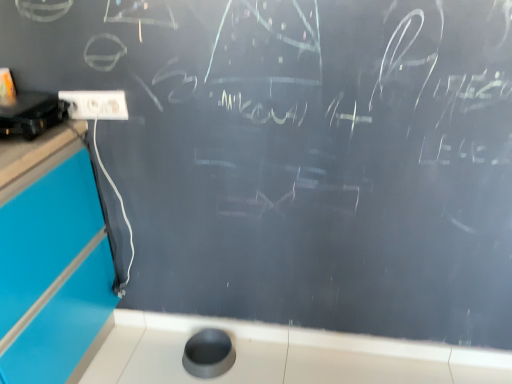
Question: Considering the positions of white plastic electric outlet at upper left and black plastic projector at upper left in the image, is white plastic electric outlet at upper left wider or thinner than black plastic projector at upper left?

Choices:
 (A) wide
 (B) thin

Answer: (B)

Question: From the image's perspective, is white plastic electric outlet at upper left located above or below black plastic projector at upper left?

Choices:
 (A) below
 (B) above

Answer: (B)

Question: Estimate the real-world distances between objects in this image. Which object is farther from the black plastic projector at upper left?

Choices:
 (A) white plastic electric outlet at upper left
 (B) white glossy counter top at lower center

Answer: (B)

Question: Estimate the real-world distances between objects in this image. Which object is closer to the white plastic electric outlet at upper left?

Choices:
 (A) white glossy counter top at lower center
 (B) black plastic projector at upper left

Answer: (B)